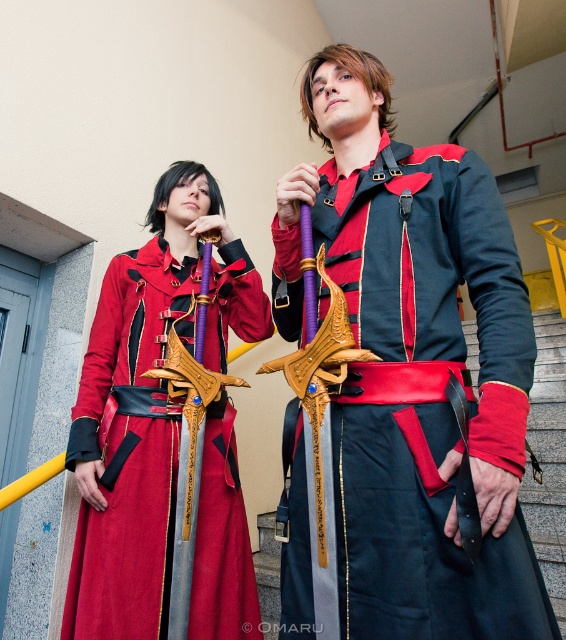
Which is above, matte black sword at center or satin red dress at center?

matte black sword at center is higher up.

Does matte black sword at center have a lesser height compared to satin red dress at center?

Correct, matte black sword at center is not as tall as satin red dress at center.

Between point (486, 320) and point (220, 589), which one is positioned behind?

Point (220, 589)

You are a GUI agent. You are given a task and a screenshot of the screen. Output one action in this format:
    pyautogui.click(x=<x>, y=<y>)
    Task: Click on the matte black sword at center
    The height and width of the screenshot is (640, 566).
    Given the screenshot: What is the action you would take?
    pyautogui.click(x=426, y=396)